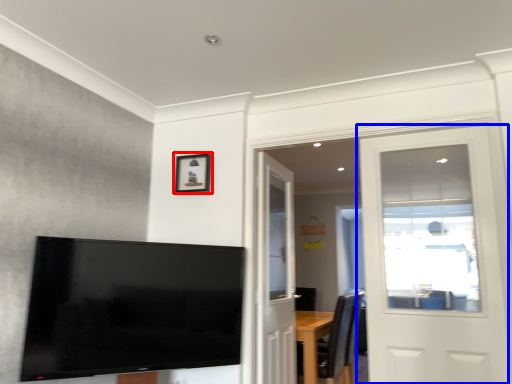
Question: Which object is closer to the camera taking this photo, picture frame (highlighted by a red box) or door (highlighted by a blue box)?

Choices:
 (A) picture frame
 (B) door

Answer: (B)